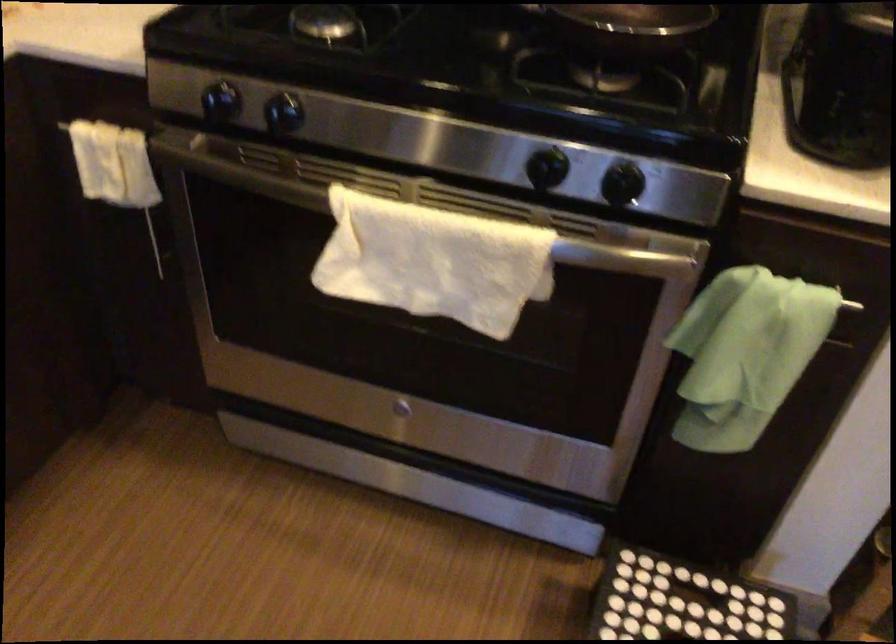
Describe the element at coordinates (283, 114) in the screenshot. This screenshot has width=896, height=644. I see `the oven door handle` at that location.